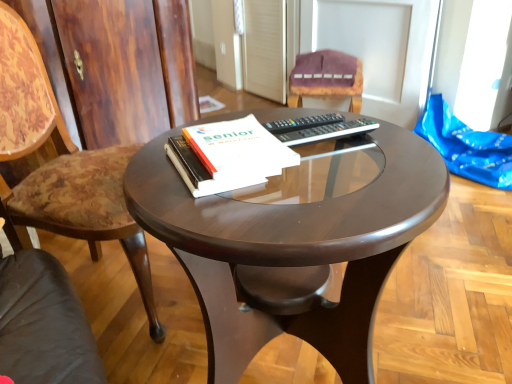
Question: Should I look upward or downward to see white paper at center?

Choices:
 (A) up
 (B) down

Answer: (A)

Question: Is velvet purple chair at upper center, which is the 2th chair from front to back, turned away from wooden chair at left, which is the second chair from right to left?

Choices:
 (A) no
 (B) yes

Answer: (A)

Question: From a real-world perspective, is velvet purple chair at upper center, arranged as the 1th chair when viewed from the back, physically above wooden chair at left, the first chair viewed from the front?

Choices:
 (A) yes
 (B) no

Answer: (B)

Question: Considering the relative sizes of velvet purple chair at upper center, which is the 2th chair from front to back, and wooden chair at left, the first chair viewed from the front, in the image provided, is velvet purple chair at upper center, which is the 2th chair from front to back, taller than wooden chair at left, the first chair viewed from the front,?

Choices:
 (A) yes
 (B) no

Answer: (B)

Question: Is velvet purple chair at upper center, which is the 2th chair from front to back, to the left of wooden chair at left, the first chair viewed from the front, from the viewer's perspective?

Choices:
 (A) yes
 (B) no

Answer: (B)

Question: From a real-world perspective, is velvet purple chair at upper center, the 2th chair when ordered from left to right, beneath wooden chair at left, which is the 2th chair in back-to-front order?

Choices:
 (A) no
 (B) yes

Answer: (B)

Question: Is velvet purple chair at upper center, arranged as the 1th chair when viewed from the back, smaller than wooden chair at left, which is the second chair from right to left?

Choices:
 (A) yes
 (B) no

Answer: (A)

Question: Are glossy wood coffee table at center and black plastic remote at center making contact?

Choices:
 (A) yes
 (B) no

Answer: (B)

Question: Can you confirm if glossy wood coffee table at center is positioned to the right of black plastic remote at center?

Choices:
 (A) yes
 (B) no

Answer: (B)

Question: Is glossy wood coffee table at center looking in the opposite direction of black plastic remote at center?

Choices:
 (A) yes
 (B) no

Answer: (B)

Question: Would you say glossy wood coffee table at center contains black plastic remote at center?

Choices:
 (A) no
 (B) yes

Answer: (B)

Question: From a real-world perspective, is glossy wood coffee table at center located higher than black plastic remote at center?

Choices:
 (A) no
 (B) yes

Answer: (A)

Question: Considering the relative sizes of glossy wood coffee table at center and black plastic remote at center in the image provided, is glossy wood coffee table at center shorter than black plastic remote at center?

Choices:
 (A) no
 (B) yes

Answer: (A)

Question: From the image's perspective, is wooden chair at left, which is the 2th chair in back-to-front order, located beneath white paper at center?

Choices:
 (A) yes
 (B) no

Answer: (A)